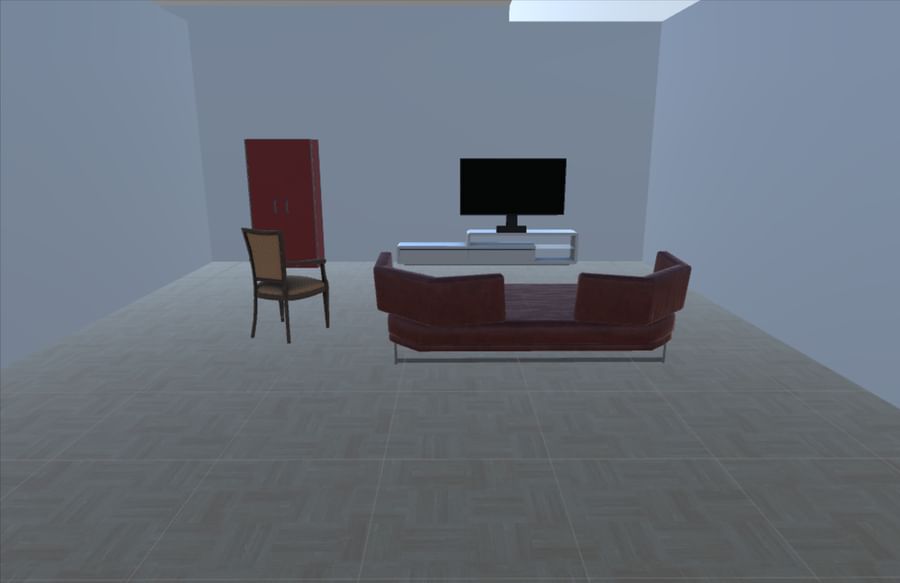
I want to click on grey walls, so click(x=389, y=119), click(x=124, y=182), click(x=793, y=207).